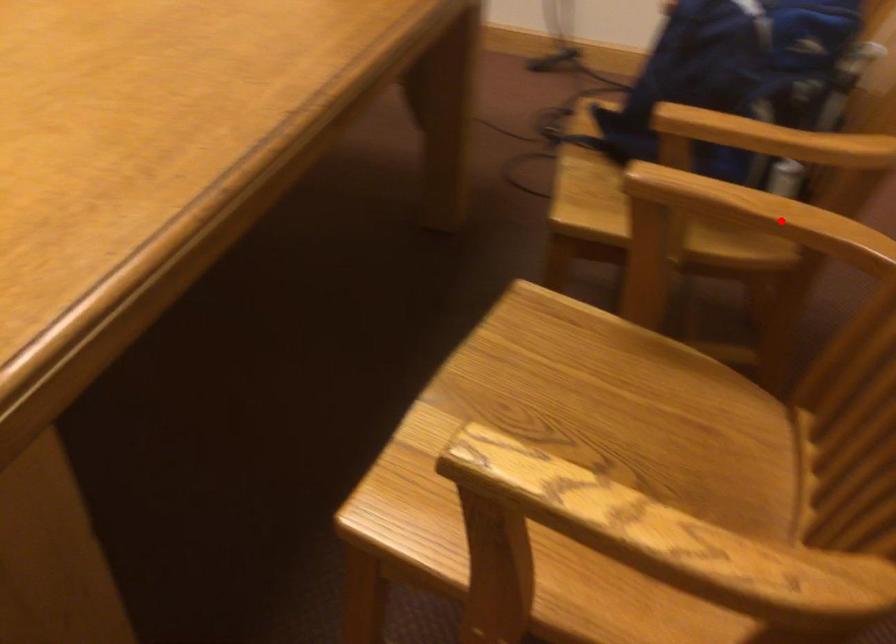
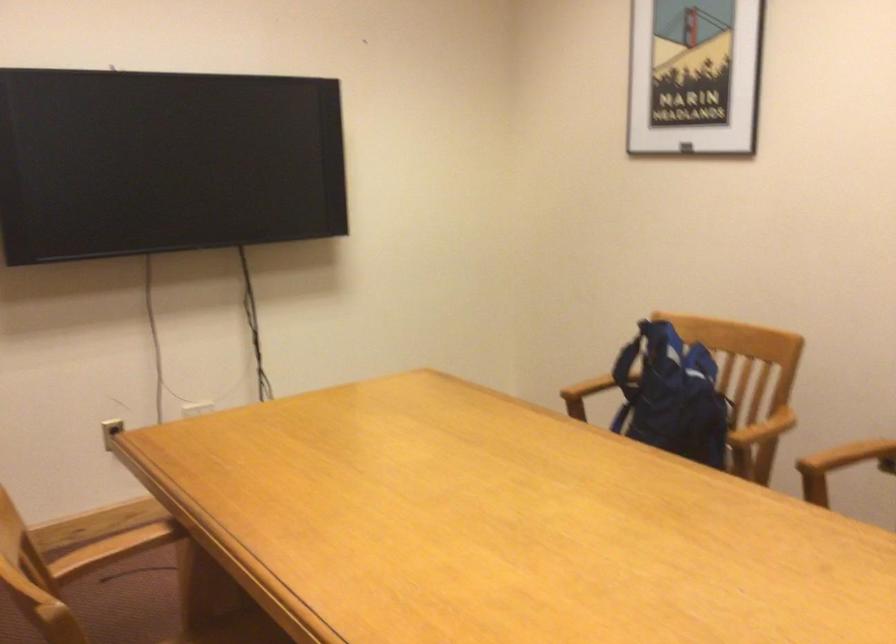
Question: A red point is marked in image1. In image2, is the corresponding 3D point closer to the camera or farther? Reply with the corresponding letter.

Choices:
 (A) The corresponding 3D point is closer.
 (B) The corresponding 3D point is farther.

Answer: (B)